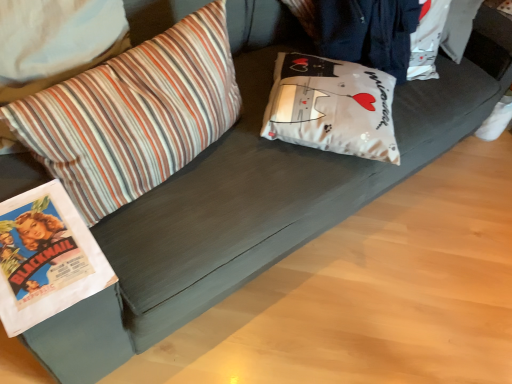
Question: Considering the relative sizes of white matte pillow at center, acting as the 2th pillow starting from the left, and striped fabric pillow at left, which is the 1th pillow in left-to-right order, in the image provided, is white matte pillow at center, acting as the 2th pillow starting from the left, bigger than striped fabric pillow at left, which is the 1th pillow in left-to-right order,?

Choices:
 (A) no
 (B) yes

Answer: (A)

Question: Could you tell me if white matte pillow at center, arranged as the first pillow when viewed from the right, is facing striped fabric pillow at left, which is the 1th pillow in left-to-right order?

Choices:
 (A) yes
 (B) no

Answer: (B)

Question: Does white matte pillow at center, acting as the 2th pillow starting from the left, have a lesser height compared to striped fabric pillow at left, positioned as the 2th pillow in right-to-left order?

Choices:
 (A) no
 (B) yes

Answer: (B)

Question: Does white matte pillow at center, arranged as the first pillow when viewed from the right, appear on the left side of striped fabric pillow at left, which is the 1th pillow in left-to-right order?

Choices:
 (A) yes
 (B) no

Answer: (B)

Question: Is striped fabric pillow at left, which is the 1th pillow in left-to-right order, inside white matte pillow at center, arranged as the first pillow when viewed from the right?

Choices:
 (A) yes
 (B) no

Answer: (B)

Question: Is white matte pillow at center, acting as the 2th pillow starting from the left, wider than striped fabric pillow at left, positioned as the 2th pillow in right-to-left order?

Choices:
 (A) no
 (B) yes

Answer: (B)

Question: Does striped fabric pillow at left, which is the 1th pillow in left-to-right order, have a lesser height compared to white matte pillow at center, arranged as the first pillow when viewed from the right?

Choices:
 (A) no
 (B) yes

Answer: (A)

Question: Is striped fabric pillow at left, which is the 1th pillow in left-to-right order, closer to the viewer compared to white matte pillow at center, acting as the 2th pillow starting from the left?

Choices:
 (A) no
 (B) yes

Answer: (B)

Question: Can you confirm if striped fabric pillow at left, positioned as the 2th pillow in right-to-left order, is thinner than white matte pillow at center, acting as the 2th pillow starting from the left?

Choices:
 (A) yes
 (B) no

Answer: (A)

Question: Considering the relative sizes of striped fabric pillow at left, positioned as the 2th pillow in right-to-left order, and white matte pillow at center, acting as the 2th pillow starting from the left, in the image provided, is striped fabric pillow at left, positioned as the 2th pillow in right-to-left order, taller than white matte pillow at center, acting as the 2th pillow starting from the left,?

Choices:
 (A) yes
 (B) no

Answer: (A)

Question: Is white matte pillow at center, acting as the 2th pillow starting from the left, inside striped fabric pillow at left, positioned as the 2th pillow in right-to-left order?

Choices:
 (A) no
 (B) yes

Answer: (A)

Question: From a real-world perspective, is striped fabric pillow at left, positioned as the 2th pillow in right-to-left order, under white matte pillow at center, acting as the 2th pillow starting from the left?

Choices:
 (A) yes
 (B) no

Answer: (B)

Question: From the image's perspective, is striped fabric pillow at left, which is the 1th pillow in left-to-right order, located above or below white matte pillow at center, acting as the 2th pillow starting from the left?

Choices:
 (A) below
 (B) above

Answer: (A)